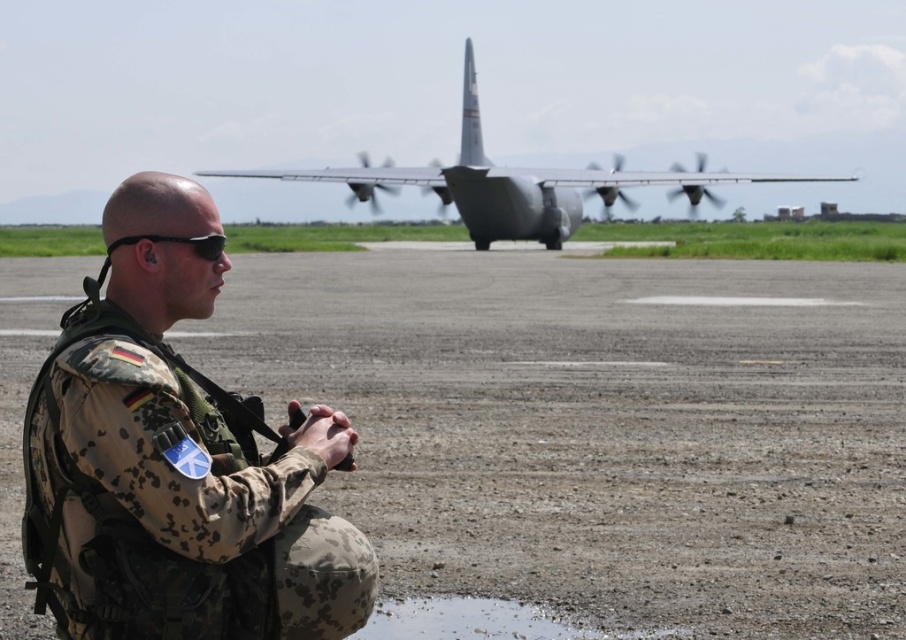
Question: Which is farther from the black matte sunglasses at left?

Choices:
 (A) dull gray tarmac at center
 (B) silver metallic airplane at center

Answer: (B)

Question: Which object is closer to the camera taking this photo?

Choices:
 (A) black matte sunglasses at left
 (B) silver metallic airplane at center
 (C) dull gray tarmac at center

Answer: (A)

Question: Is silver metallic airplane at center closer to camera compared to black matte sunglasses at left?

Choices:
 (A) yes
 (B) no

Answer: (B)

Question: In this image, where is dull gray tarmac at center located relative to silver metallic airplane at center?

Choices:
 (A) below
 (B) above

Answer: (A)

Question: Based on their relative distances, which object is nearer to the black matte sunglasses at left?

Choices:
 (A) dull gray tarmac at center
 (B) camouflage uniform at left

Answer: (B)

Question: Is camouflage uniform at left positioned behind black matte sunglasses at left?

Choices:
 (A) yes
 (B) no

Answer: (B)